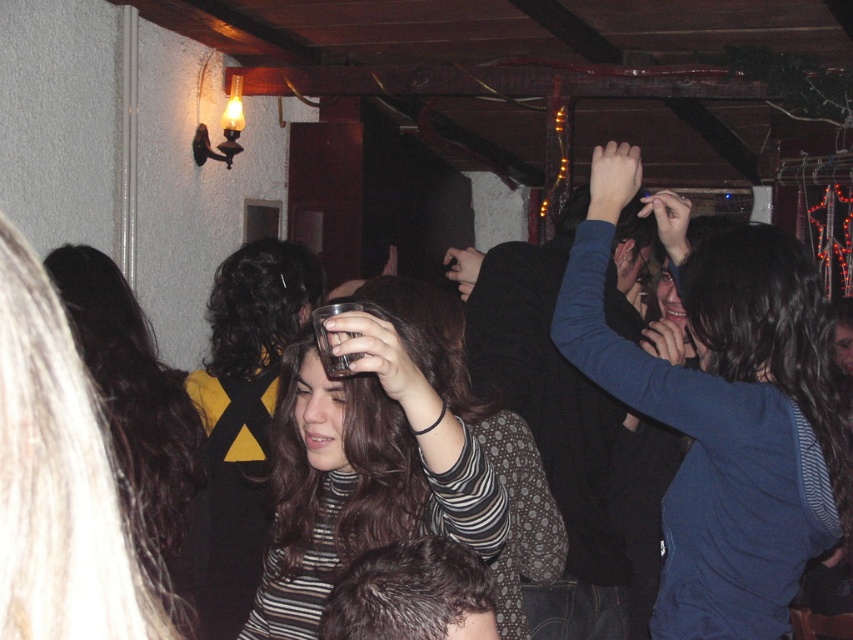
Is matte plastic cup at center further to camera compared to dark brown hair at center?

No, matte plastic cup at center is in front of dark brown hair at center.

Who is shorter, matte plastic cup at center or dark brown hair at center?

matte plastic cup at center is shorter.

Where is `matte plastic cup at center`? matte plastic cup at center is located at coordinates (370, 452).

Between matte plastic cup at center and striped fabric shirt at center, which one is positioned higher?

Positioned higher is striped fabric shirt at center.

Which is in front, point (344, 557) or point (235, 572)?

Point (344, 557) is more forward.

Is point (251, 632) farther from viewer compared to point (300, 276)?

No.

In order to click on matte plastic cup at center in this screenshot , I will do `click(370, 452)`.

Is striped fabric shirt at center wider than dark brown hair at center?

Yes, striped fabric shirt at center is wider than dark brown hair at center.

Between striped fabric shirt at center and dark brown hair at center, which one appears on the right side from the viewer's perspective?

From the viewer's perspective, striped fabric shirt at center appears more on the right side.

Who is more forward, (236, 266) or (178, 586)?

Point (178, 586) is more forward.

You are a GUI agent. You are given a task and a screenshot of the screen. Output one action in this format:
    pyautogui.click(x=<x>, y=<y>)
    Task: Click on the striped fabric shirt at center
    The image size is (853, 640).
    Given the screenshot: What is the action you would take?
    pyautogui.click(x=242, y=417)